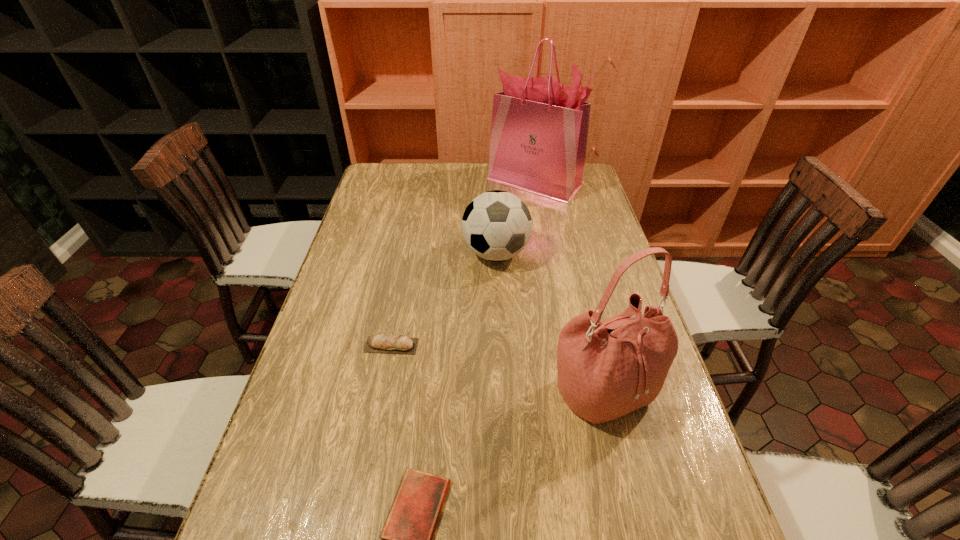
I want to click on the farthest object, so click(539, 131).

At what (x,y) coordinates should I click in order to perform the action: click on shopping bag. Please return your answer as a coordinate pair (x, y). Image resolution: width=960 pixels, height=540 pixels. Looking at the image, I should click on (539, 131).

At what (x,y) coordinates should I click in order to perform the action: click on the fourth shortest object. Please return your answer as a coordinate pair (x, y). Image resolution: width=960 pixels, height=540 pixels. Looking at the image, I should click on (606, 369).

The width and height of the screenshot is (960, 540). Find the location of `the third shortest object`. the third shortest object is located at coordinates (496, 225).

The height and width of the screenshot is (540, 960). Identify the location of soccer ball. (496, 225).

Find the location of a particular element. This screenshot has height=540, width=960. the fourth tallest object is located at coordinates (398, 344).

The image size is (960, 540). I want to click on vacant space positioned 0.200m on the left of the shopping bag, so click(x=435, y=182).

At what (x,y) coordinates should I click in order to perform the action: click on vacant area located on the left of the handbag. Please return your answer as a coordinate pair (x, y). The width and height of the screenshot is (960, 540). Looking at the image, I should click on (438, 390).

In order to click on free space located 0.060m on the main logo of the second farthest object in this screenshot , I will do `click(497, 290)`.

Where is `free space located 0.210m on the right of the fourth tallest object`? free space located 0.210m on the right of the fourth tallest object is located at coordinates (501, 346).